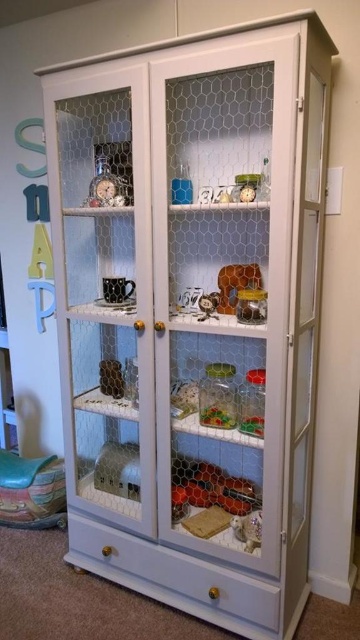
Measure the distance from matte black figurine at center to metallic silver toy at center.

A distance of 19.45 inches exists between matte black figurine at center and metallic silver toy at center.

Does point (120, 397) come in front of point (200, 310)?

No, (120, 397) is further to viewer.

Where is `matte black figurine at center`? This screenshot has width=360, height=640. matte black figurine at center is located at coordinates (110, 378).

Is matte black figurine at center to the right of matte plastic toy at center from the viewer's perspective?

Incorrect, matte black figurine at center is not on the right side of matte plastic toy at center.

Can you confirm if matte black figurine at center is positioned below matte plastic toy at center?

Yes.

Locate an element on the screen. The width and height of the screenshot is (360, 640). matte black figurine at center is located at coordinates (110, 378).

Is metallic clock at upper left closer to the viewer compared to matte black figurine at center?

Yes, it is.

What do you see at coordinates (108, 186) in the screenshot? I see `metallic clock at upper left` at bounding box center [108, 186].

Locate an element on the screen. The image size is (360, 640). metallic clock at upper left is located at coordinates pyautogui.click(x=108, y=186).